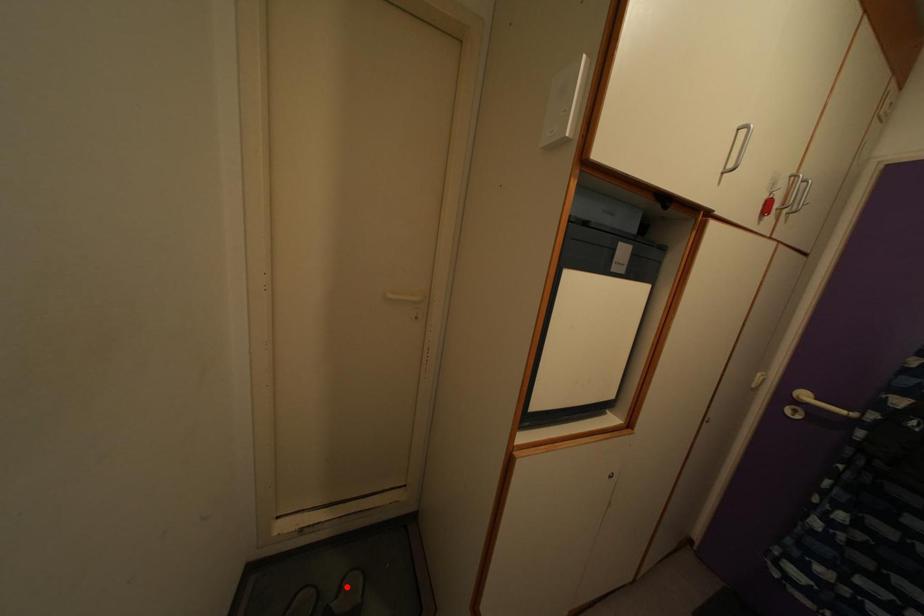
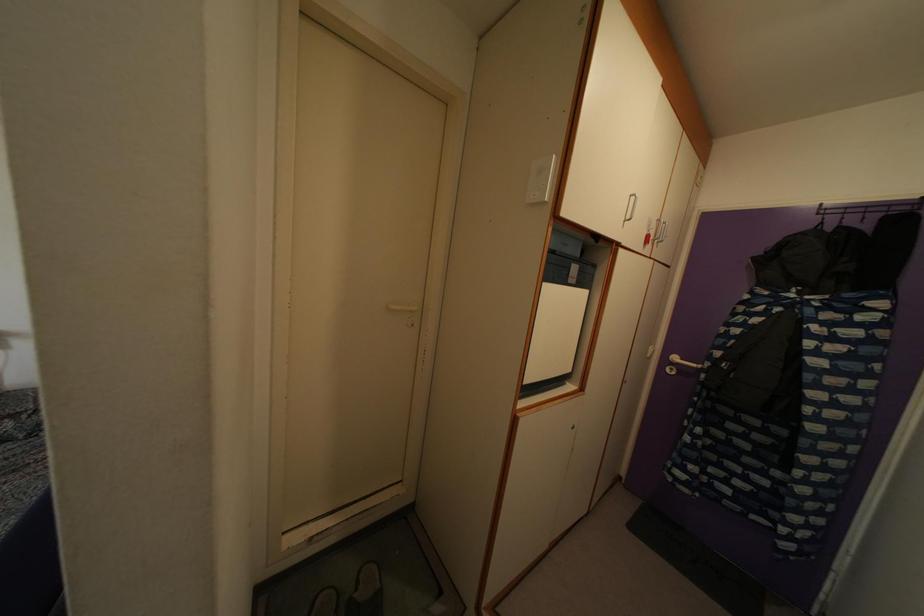
In the second image, find the point that corresponds to the highlighted location in the first image.

(361, 581)